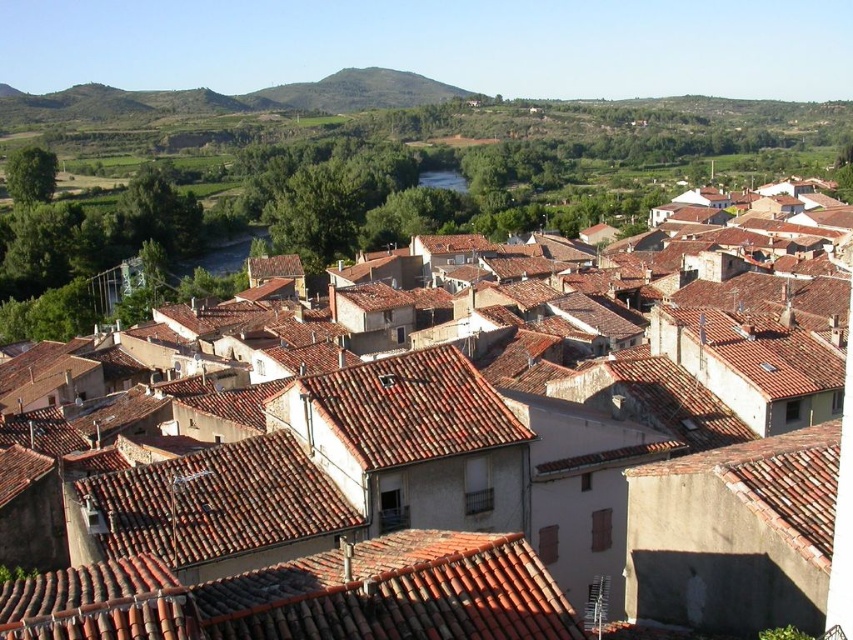
Question: Which object is positioned closest to the red clay tiles at center?

Choices:
 (A) brown tile roofs at center
 (B) brown tile roof at center

Answer: (A)

Question: Which point is closer to the camera taking this photo?

Choices:
 (A) (33, 632)
 (B) (424, 417)

Answer: (A)

Question: Where is red clay tiles at center located in relation to brown tile roof at center in the image?

Choices:
 (A) left
 (B) right

Answer: (A)

Question: Which object is farther from the camera taking this photo?

Choices:
 (A) red clay tiles at center
 (B) brown tile roofs at center

Answer: (B)

Question: From the image, what is the correct spatial relationship of brown tile roofs at center in relation to brown tile roof at center?

Choices:
 (A) above
 (B) below

Answer: (A)

Question: Is brown tile roofs at center below red clay tiles at center?

Choices:
 (A) no
 (B) yes

Answer: (A)